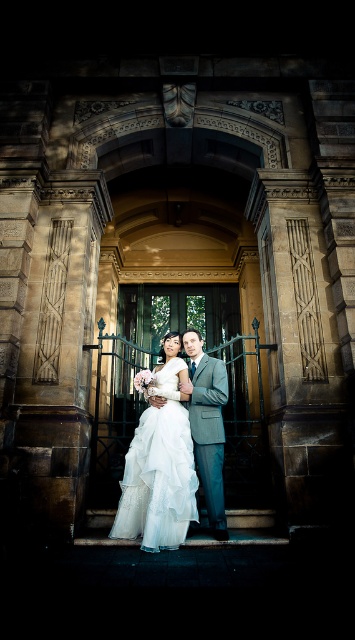
Does white tulle dress at center appear under light gray suit at center?

Yes.

Can you confirm if white tulle dress at center is bigger than light gray suit at center?

Yes, white tulle dress at center is bigger than light gray suit at center.

The image size is (355, 640). I want to click on white tulle dress at center, so click(x=160, y=464).